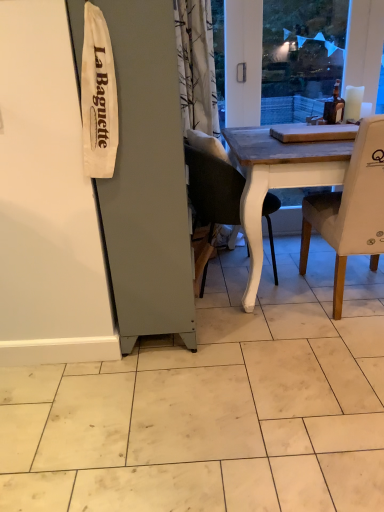
Identify the location of free space in front of matte black chair at center, which is the second chair from right to left. (249, 324).